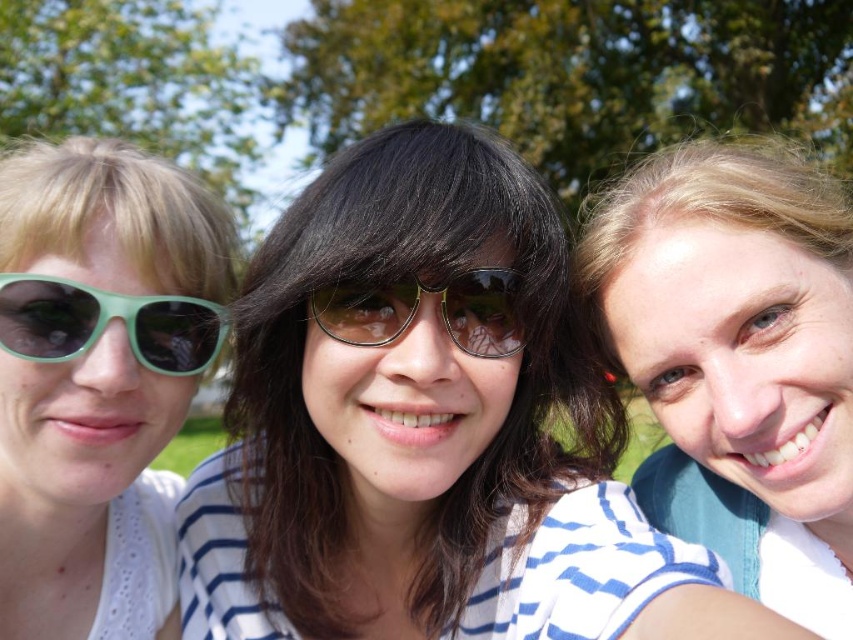
You are trying to decide which item to purchase between the matte black sunglasses at center and the white striped shirt at center. If you prefer a wider item, which one should you choose?

The matte black sunglasses at center has a larger width than the white striped shirt at center, so you should choose the matte black sunglasses at center if you prefer a wider item.

You are standing in a park and see the matte green sunglasses at left. If you want to find their exact position using a coordinate system where the bottom left corner is the origin, what coordinates would you use?

The coordinates for the matte green sunglasses at left are at point (97, 380).